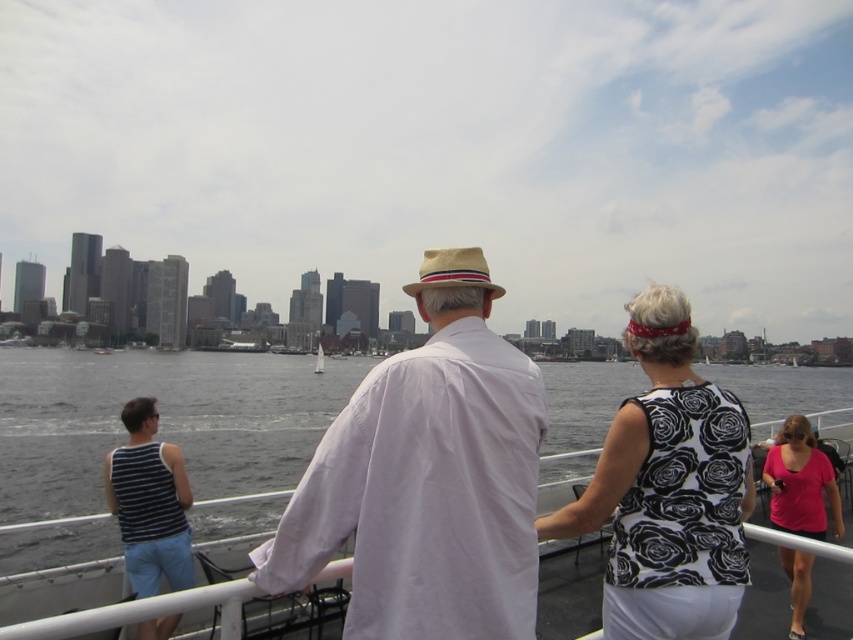
You are standing on the ferry and want to take a photo of both the point at coordinates (175, 534) and the point at coordinates (798, 516) in the scene. Which point should you focus on first to ensure both are in focus?

You should focus on the point at coordinates (175, 534) first because it is closer to the camera than the point at coordinates (798, 516). By focusing on the closer point, the farther point will also be in focus due to the depth of field.

You are a photographer trying to capture the dark gray water at center in the image. Based on its position, would you adjust your camera to focus on the upper or lower part of the frame?

The dark gray water at center is located at point 0.659 on the x axis and 0.189 on the y axis. Since the y coordinate is closer to 0, which represents the bottom of the frame, you should adjust your camera to focus on the lower part of the frame to capture the dark gray water at center.